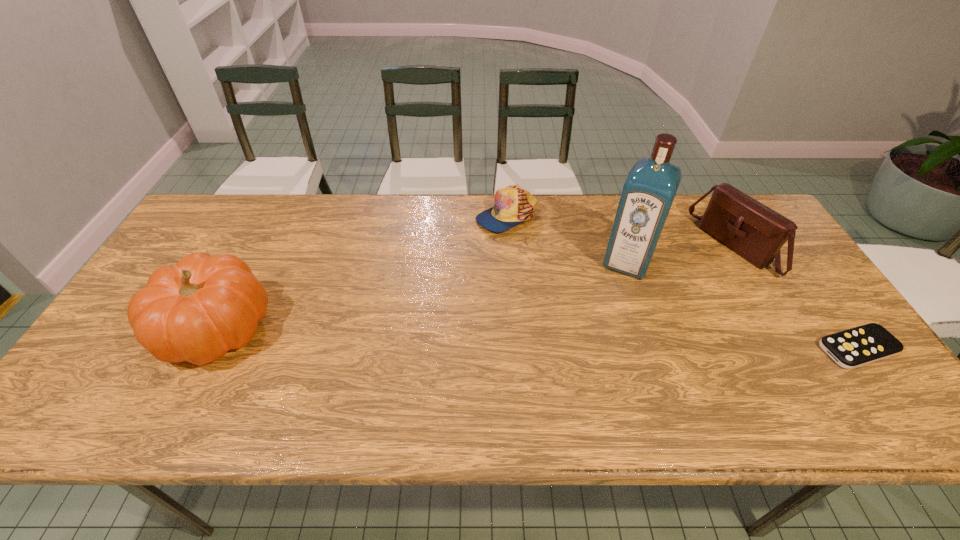
The width and height of the screenshot is (960, 540). Identify the location of the leftmost object. (197, 310).

At what (x,y) coordinates should I click in order to perform the action: click on pumpkin. Please return your answer as a coordinate pair (x, y). Looking at the image, I should click on point(197,310).

Find the location of a particular element. The height and width of the screenshot is (540, 960). the shortest object is located at coordinates (851, 348).

Where is `liquor`? This screenshot has height=540, width=960. liquor is located at coordinates (648, 193).

You are a GUI agent. You are given a task and a screenshot of the screen. Output one action in this format:
    pyautogui.click(x=<x>, y=<y>)
    Task: Click on the tallest object
    
    Given the screenshot: What is the action you would take?
    pyautogui.click(x=648, y=193)

Where is `the third shortest object`? This screenshot has width=960, height=540. the third shortest object is located at coordinates (751, 229).

The image size is (960, 540). What are the coordinates of `the fourth object from right to left` in the screenshot? It's located at (512, 205).

Identify the location of the second shortest object. (512, 205).

You are a GUI agent. You are given a task and a screenshot of the screen. Output one action in this format:
    pyautogui.click(x=<x>, y=<y>)
    Task: Click on the free space located on the right of the fourth shortest object
    Image resolution: width=960 pixels, height=540 pixels.
    Given the screenshot: What is the action you would take?
    pyautogui.click(x=302, y=328)

The height and width of the screenshot is (540, 960). Find the location of `free space located on the back of the remote control`. free space located on the back of the remote control is located at coordinates (808, 279).